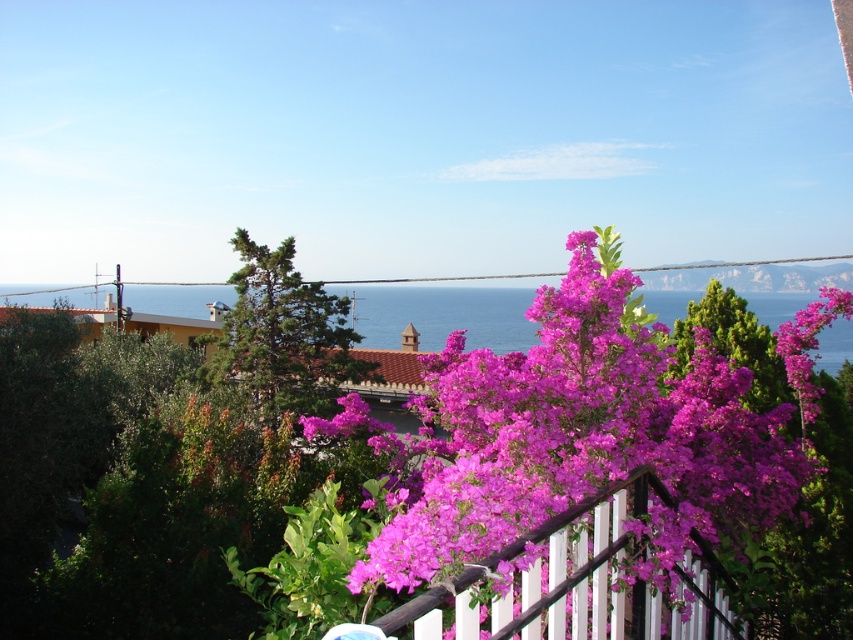
Question: Which point appears closest to the camera in this image?

Choices:
 (A) (490, 628)
 (B) (418, 493)

Answer: (A)

Question: Can you confirm if purple matte flowers at center is bigger than wooden fence at center?

Choices:
 (A) no
 (B) yes

Answer: (B)

Question: Is purple matte flowers at center to the left of wooden fence at center from the viewer's perspective?

Choices:
 (A) no
 (B) yes

Answer: (B)

Question: Which point appears closest to the camera in this image?

Choices:
 (A) (393, 625)
 (B) (434, 360)

Answer: (A)

Question: Does purple matte flowers at center have a smaller size compared to wooden fence at center?

Choices:
 (A) yes
 (B) no

Answer: (B)